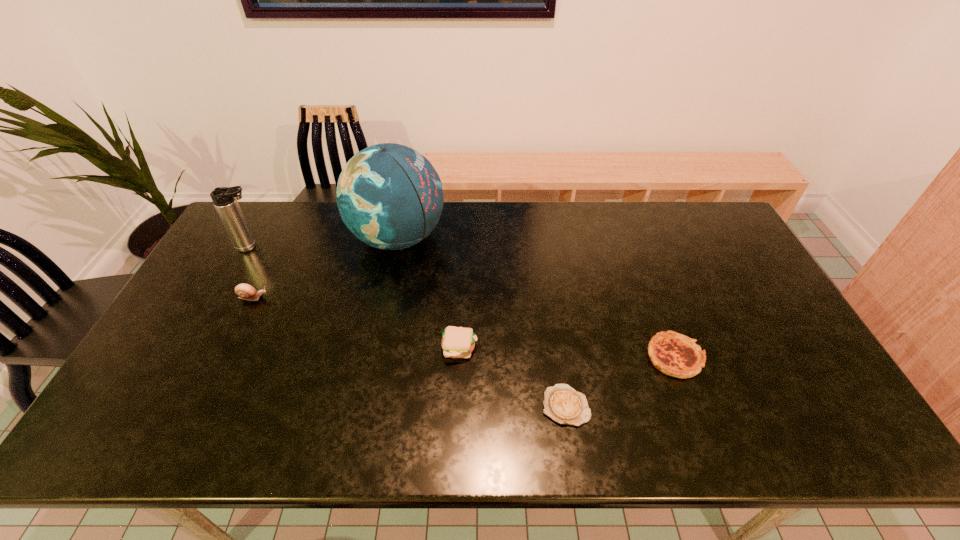
I want to click on vacant space located 0.270m on the handle side of the second tallest object, so click(x=347, y=247).

The image size is (960, 540). I want to click on vacant space situated 0.140m on the front-facing side of the third farthest object, so click(x=315, y=298).

The image size is (960, 540). In order to click on free space located on the front of the third object from right to left in this screenshot , I will do `click(457, 413)`.

The image size is (960, 540). I want to click on vacant space located on the left of the taller quiche, so click(x=572, y=357).

You are a GUI agent. You are given a task and a screenshot of the screen. Output one action in this format:
    pyautogui.click(x=<x>, y=<y>)
    Task: Click on the vacant space located on the left of the nearer quiche
    The image size is (960, 540).
    Given the screenshot: What is the action you would take?
    point(410,406)

The height and width of the screenshot is (540, 960). In order to click on globe that is at the far edge in this screenshot , I will do `click(389, 196)`.

Where is `thermos bottle that is at the far edge`? thermos bottle that is at the far edge is located at coordinates click(x=224, y=199).

The width and height of the screenshot is (960, 540). Find the location of `object located in the near edge section of the desktop`. object located in the near edge section of the desktop is located at coordinates (563, 404).

At what (x,y) coordinates should I click in order to perform the action: click on thermos bottle present at the left edge. Please return your answer as a coordinate pair (x, y). Image resolution: width=960 pixels, height=540 pixels. Looking at the image, I should click on (224, 199).

Identify the location of escargot positioned at the left edge. (245, 291).